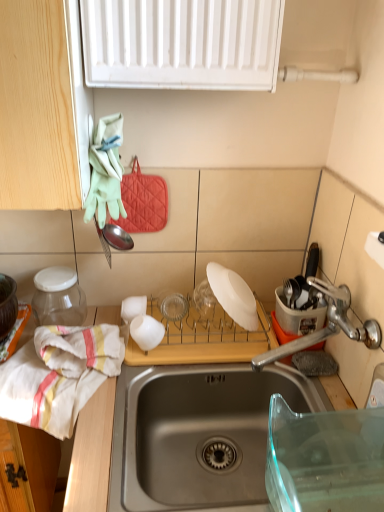
Question: Is white matte cup at center positioned with its back to white cotton towel at left?

Choices:
 (A) no
 (B) yes

Answer: (A)

Question: From the image's perspective, is white matte cup at center below white cotton towel at left?

Choices:
 (A) yes
 (B) no

Answer: (B)

Question: Is white matte cup at center closer to camera compared to white cotton towel at left?

Choices:
 (A) yes
 (B) no

Answer: (B)

Question: Is white matte cup at center shorter than white cotton towel at left?

Choices:
 (A) yes
 (B) no

Answer: (A)

Question: Considering the relative sizes of white matte cup at center and white cotton towel at left in the image provided, is white matte cup at center taller than white cotton towel at left?

Choices:
 (A) yes
 (B) no

Answer: (B)

Question: Could you tell me if white matte cup at center is turned towards white cotton towel at left?

Choices:
 (A) no
 (B) yes

Answer: (A)

Question: Is satin nickel faucet at right shorter than white matte plate at center, the second appliance from the left?

Choices:
 (A) no
 (B) yes

Answer: (A)

Question: From the image's perspective, is satin nickel faucet at right located beneath white matte plate at center, the second appliance from the left?

Choices:
 (A) no
 (B) yes

Answer: (A)

Question: Does satin nickel faucet at right have a greater width compared to white matte plate at center, which is the second appliance in right-to-left order?

Choices:
 (A) no
 (B) yes

Answer: (B)

Question: Considering the relative positions of satin nickel faucet at right and white matte plate at center, which is the second appliance in right-to-left order, in the image provided, is satin nickel faucet at right behind white matte plate at center, which is the second appliance in right-to-left order,?

Choices:
 (A) no
 (B) yes

Answer: (A)

Question: Could white matte plate at center, the second appliance from the left, be considered to be inside satin nickel faucet at right?

Choices:
 (A) yes
 (B) no

Answer: (B)

Question: Can you confirm if satin nickel faucet at right is thinner than white matte plate at center, which is the second appliance in right-to-left order?

Choices:
 (A) no
 (B) yes

Answer: (A)

Question: From the image's perspective, is white matte cup at center on satin nickel faucet at right?

Choices:
 (A) no
 (B) yes

Answer: (A)